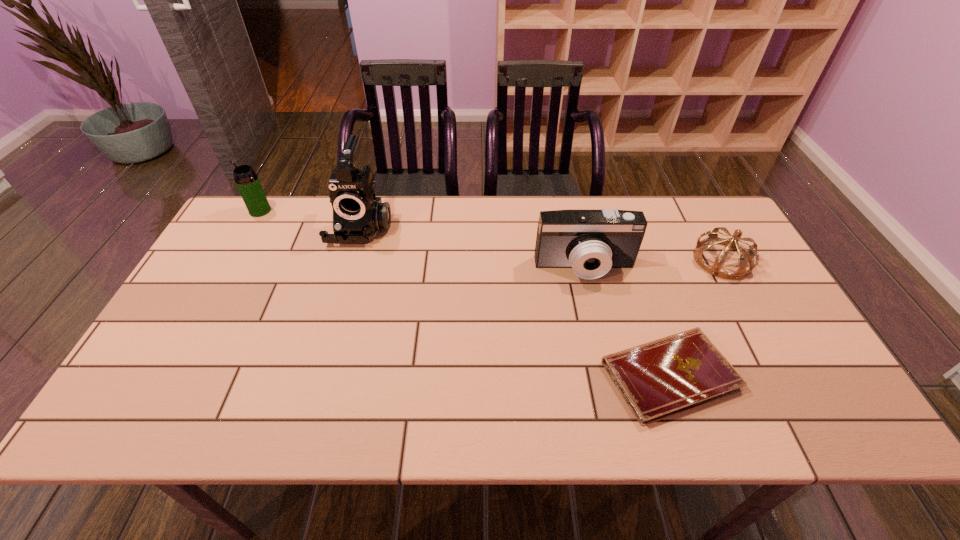
Where is `vacant position in the image that satisfies the following two spatial constraints: 1. on the lens of the nearer camcorder; 2. on the left side of the shortest object`? The image size is (960, 540). vacant position in the image that satisfies the following two spatial constraints: 1. on the lens of the nearer camcorder; 2. on the left side of the shortest object is located at coordinates (610, 375).

Locate an element on the screen. The height and width of the screenshot is (540, 960). free space in the image that satisfies the following two spatial constraints: 1. on the back side of the shortest object; 2. from the spout of the leftmost object is located at coordinates (613, 211).

Find the location of a particular element. free space in the image that satisfies the following two spatial constraints: 1. on the back side of the tiara; 2. from the spout of the thermos bottle is located at coordinates (695, 211).

Where is `free spot that satisfies the following two spatial constraints: 1. on the back side of the tiara; 2. from the spout of the leftmost object`? This screenshot has width=960, height=540. free spot that satisfies the following two spatial constraints: 1. on the back side of the tiara; 2. from the spout of the leftmost object is located at coordinates (695, 211).

You are a GUI agent. You are given a task and a screenshot of the screen. Output one action in this format:
    pyautogui.click(x=<x>, y=<y>)
    Task: Click on the vacant position in the image that satisfies the following two spatial constraints: 1. from the spout of the thermos bottle; 2. on the right side of the second shortest object
    The height and width of the screenshot is (540, 960).
    Given the screenshot: What is the action you would take?
    pyautogui.click(x=232, y=260)

In order to click on free space in the image that satisfies the following two spatial constraints: 1. on the lens of the right camcorder; 2. on the left side of the shortest object in this screenshot , I will do (610, 375).

I want to click on vacant space that satisfies the following two spatial constraints: 1. on the lens of the nearer camcorder; 2. on the right side of the nearest object, so click(610, 375).